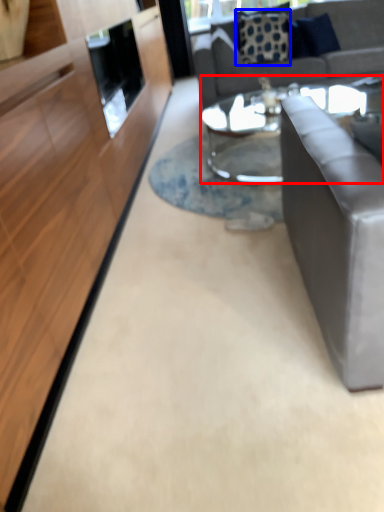
Question: Which object is further to the camera taking this photo, coffee table (highlighted by a red box) or pillow (highlighted by a blue box)?

Choices:
 (A) coffee table
 (B) pillow

Answer: (B)